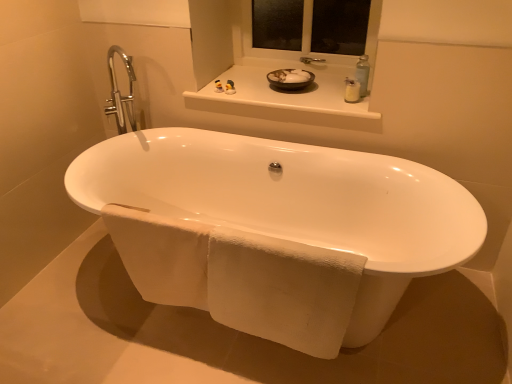
Where is `free region on the left part of white glossy bowl at upper center`? The height and width of the screenshot is (384, 512). free region on the left part of white glossy bowl at upper center is located at coordinates (248, 89).